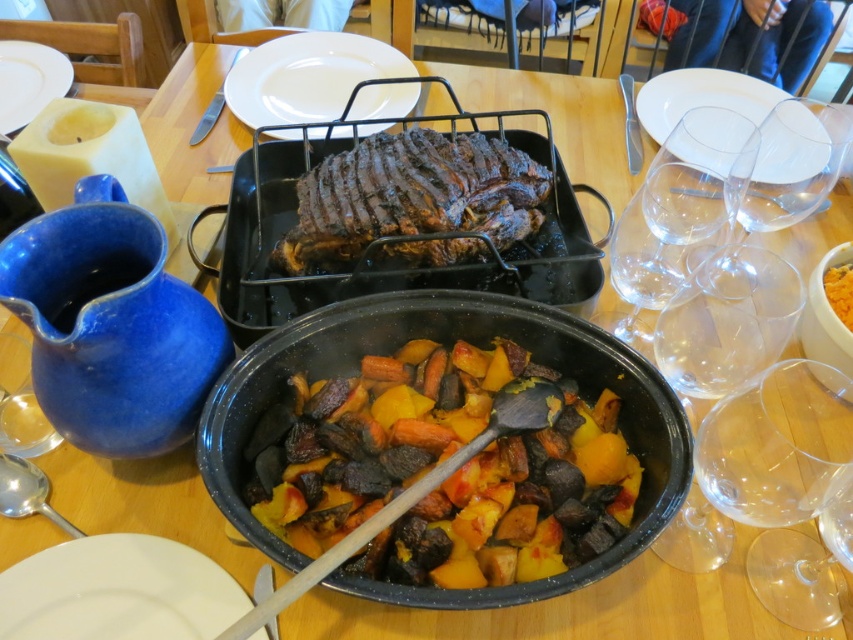
Question: Considering the relative positions of transparent glass wine glass at lower right and yellow-orange textured bread at upper right in the image provided, where is transparent glass wine glass at lower right located with respect to yellow-orange textured bread at upper right?

Choices:
 (A) right
 (B) left

Answer: (B)

Question: Which point appears farthest from the camera in this image?

Choices:
 (A) (646, 112)
 (B) (834, 296)

Answer: (A)

Question: Does transparent glass wine glass at right come behind white ceramic plate at upper right?

Choices:
 (A) yes
 (B) no

Answer: (B)

Question: From the image, what is the correct spatial relationship of orange-brown glazed meat at center in relation to yellow-orange textured bread at upper right?

Choices:
 (A) right
 (B) left

Answer: (B)

Question: Based on their relative distances, which object is nearer to the white ceramic plate at upper left?

Choices:
 (A) white ceramic plate at center
 (B) silver metallic knife at upper left
 (C) orange-brown glazed meat at center

Answer: (B)

Question: Which object is the farthest from the orange-brown glazed meat at center?

Choices:
 (A) transparent glass wine glass at upper right
 (B) white ceramic plate at upper right
 (C) yellow-orange textured bread at upper right
 (D) white ceramic plate at center

Answer: (B)